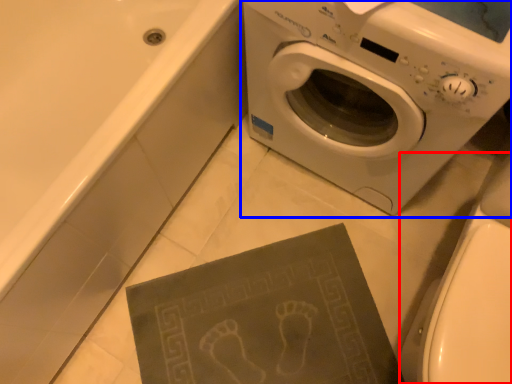
Question: Among these objects, which one is farthest to the camera, toilet bowl (highlighted by a red box) or washing machine (highlighted by a blue box)?

Choices:
 (A) toilet bowl
 (B) washing machine

Answer: (B)